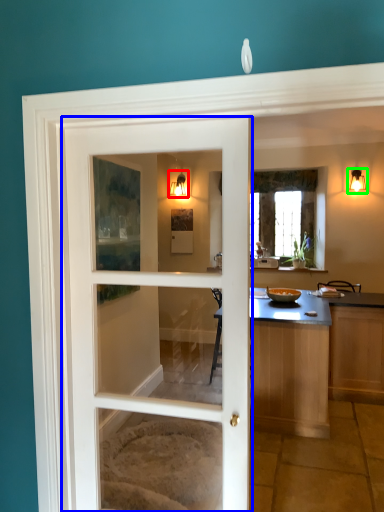
Question: Which is farther away from light fixture (highlighted by a red box)? door (highlighted by a blue box) or light fixture (highlighted by a green box)?

Choices:
 (A) door
 (B) light fixture

Answer: (A)